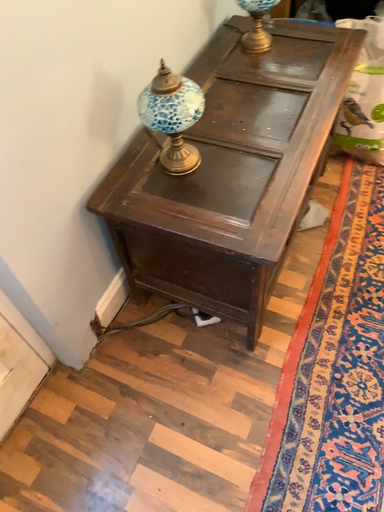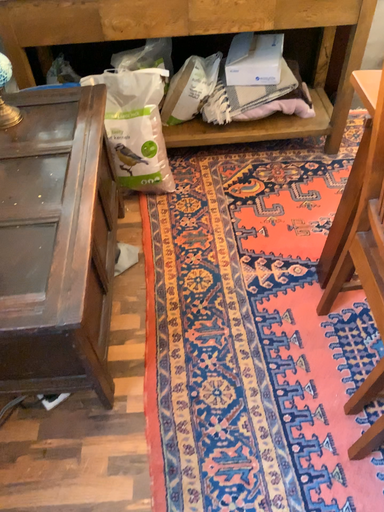
Question: Which way did the camera rotate in the video?

Choices:
 (A) rotated downward
 (B) rotated upward

Answer: (B)